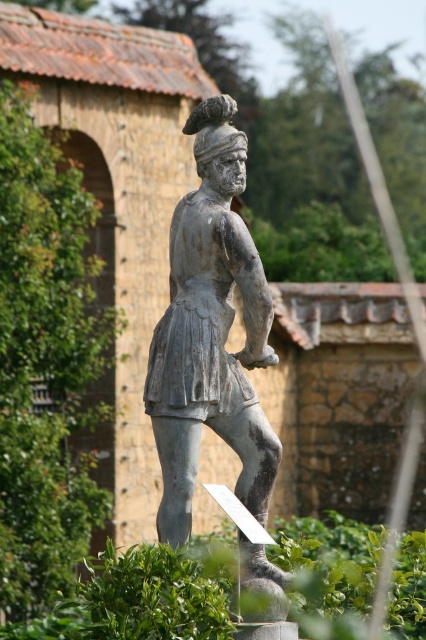
Question: Is matte gray statue at center positioned in front of gray stone statue at center?

Choices:
 (A) no
 (B) yes

Answer: (A)

Question: Among these objects, which one is nearest to the camera?

Choices:
 (A) matte gray statue at center
 (B) gray stone statue at center

Answer: (B)

Question: In this image, where is matte gray statue at center located relative to gray stone statue at center?

Choices:
 (A) left
 (B) right

Answer: (B)

Question: Is matte gray statue at center bigger than gray stone statue at center?

Choices:
 (A) yes
 (B) no

Answer: (B)

Question: Which point is closer to the camera?

Choices:
 (A) (221, 291)
 (B) (141, 637)

Answer: (B)